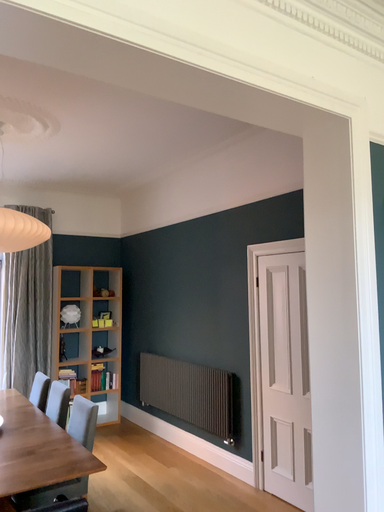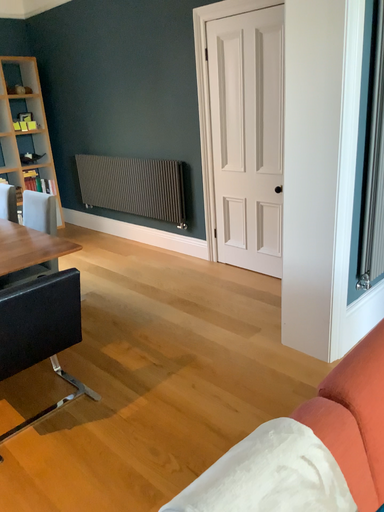
Question: How did the camera likely rotate when shooting the video?

Choices:
 (A) rotated right
 (B) rotated left

Answer: (A)